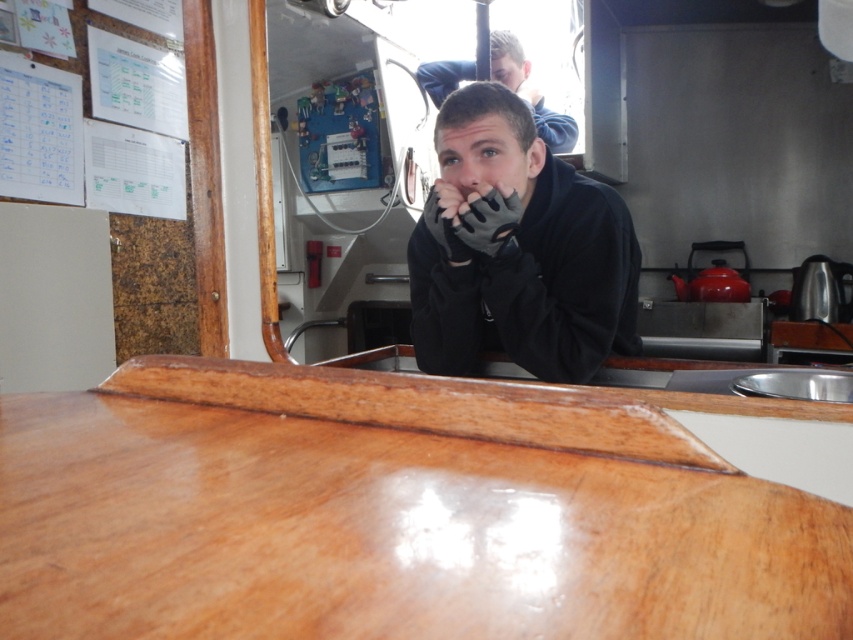
You are standing in a small cabin and see a point at coordinate (529, 90). What object is located at that point?

The point at coordinate (529, 90) is on the matte black jacket at upper center.

You are standing in the cabin and want to reach both the point at coordinates point (438,260) and the point at coordinates point (515,198). Which point is closer to you?

Point (438,260) is further to the camera than point (515,198), so the point at coordinates point (515,198) is closer to you.

You are standing in a small cabin or boat interior with a wooden table in front of you. You need to reach the black matte gloves at center without moving your feet. Can you do it?

The black matte gloves at center is 1.20 meters away from viewer, so if you can reach 1.20 meters without moving your feet, you can do it. Otherwise, you might need to move closer.